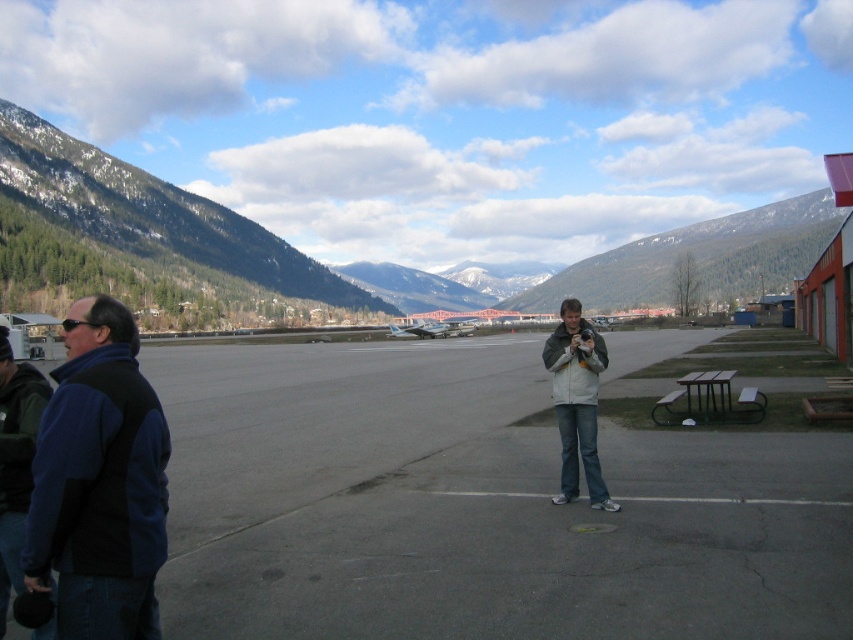
You are standing at the center of the airfield and want to take a photo of the green forested mountain at left. In which direction should you turn to face the mountain?

The green forested mountain at left is located at point coordinates (144, 243), so you should turn to your left to face the mountain.

Consider the image. You are a photographer trying to capture a clear shot of the gray asphalt tarmac at center and the light gray fleece jacket at center. Based on their positions, which object is closer to the camera?

The gray asphalt tarmac at center is closer to the camera because it is positioned in front of the light gray fleece jacket at center.

You are standing on the airfield and want to take a photo of the green forested mountain at left. The blue fleece vest at left is blocking your view. Which direction should you move to ensure the mountain is fully visible?

Move to the right of the blue fleece vest at left so the green forested mountain at left is no longer blocked.